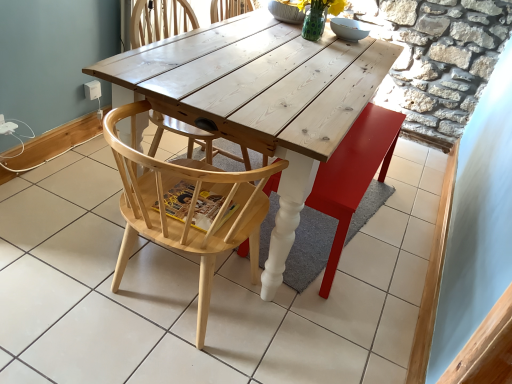
Question: From the image's perspective, is natural wood chair at center, which is counted as the 2th chair, starting from the back, under wooden swivel chair at center?

Choices:
 (A) yes
 (B) no

Answer: (A)

Question: Is natural wood chair at center, which is counted as the 2th chair, starting from the back, taller than wooden swivel chair at center?

Choices:
 (A) no
 (B) yes

Answer: (B)

Question: Does natural wood chair at center, the 1th chair viewed from the front, turn towards wooden swivel chair at center?

Choices:
 (A) no
 (B) yes

Answer: (A)

Question: Are natural wood chair at center, the 1th chair viewed from the front, and wooden swivel chair at center making contact?

Choices:
 (A) yes
 (B) no

Answer: (B)

Question: Does natural wood chair at center, the 1th chair viewed from the front, have a larger size compared to wooden swivel chair at center?

Choices:
 (A) no
 (B) yes

Answer: (B)

Question: Does natural wood chair at center, which is counted as the 2th chair, starting from the back, contain wooden swivel chair at center?

Choices:
 (A) yes
 (B) no

Answer: (B)

Question: Can you confirm if white wood table at center is thinner than natural wood chair at center, the 1th chair viewed from the front?

Choices:
 (A) yes
 (B) no

Answer: (B)

Question: From a real-world perspective, is white wood table at center over natural wood chair at center, the 1th chair viewed from the front?

Choices:
 (A) no
 (B) yes

Answer: (A)

Question: Is the surface of white wood table at center in direct contact with natural wood chair at center, which is counted as the 2th chair, starting from the back?

Choices:
 (A) yes
 (B) no

Answer: (B)

Question: Is white wood table at center to the right of natural wood chair at center, the 1th chair viewed from the front, from the viewer's perspective?

Choices:
 (A) no
 (B) yes

Answer: (B)

Question: Considering the relative sizes of white wood table at center and natural wood chair at center, which is counted as the 2th chair, starting from the back, in the image provided, is white wood table at center bigger than natural wood chair at center, which is counted as the 2th chair, starting from the back,?

Choices:
 (A) yes
 (B) no

Answer: (A)

Question: From the image's perspective, does white wood table at center appear lower than natural wood chair at center, the 1th chair viewed from the front?

Choices:
 (A) yes
 (B) no

Answer: (B)

Question: Is there a large distance between white wood table at center and wooden swivel chair at center?

Choices:
 (A) yes
 (B) no

Answer: (B)